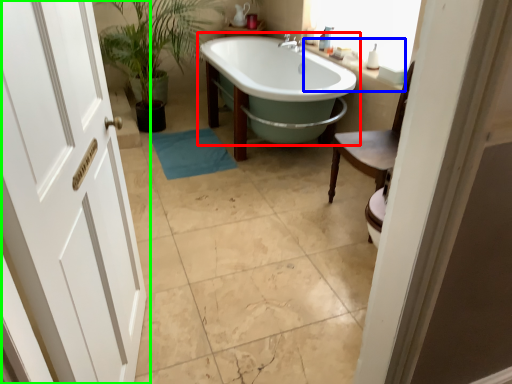
Question: Considering the real-world distances, which object is closest to bathtub (highlighted by a red box)? counter top (highlighted by a blue box) or door (highlighted by a green box).

Choices:
 (A) counter top
 (B) door

Answer: (A)